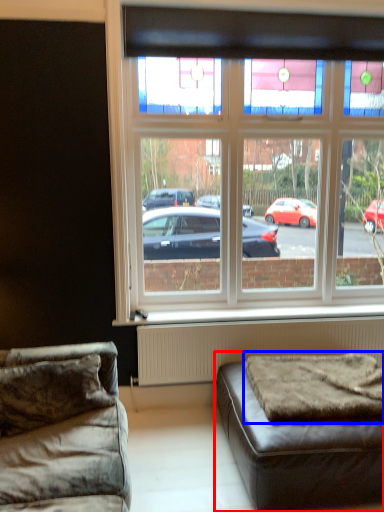
Question: Which object is closer to the camera taking this photo, studio couch (highlighted by a red box) or mattress (highlighted by a blue box)?

Choices:
 (A) studio couch
 (B) mattress

Answer: (A)